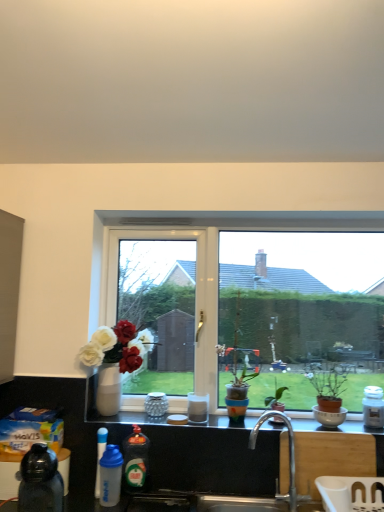
In order to click on vacant space that is to the left of porcelain textured cup at window, the 1th coffee cup when ordered from left to right in this screenshot , I will do `click(115, 419)`.